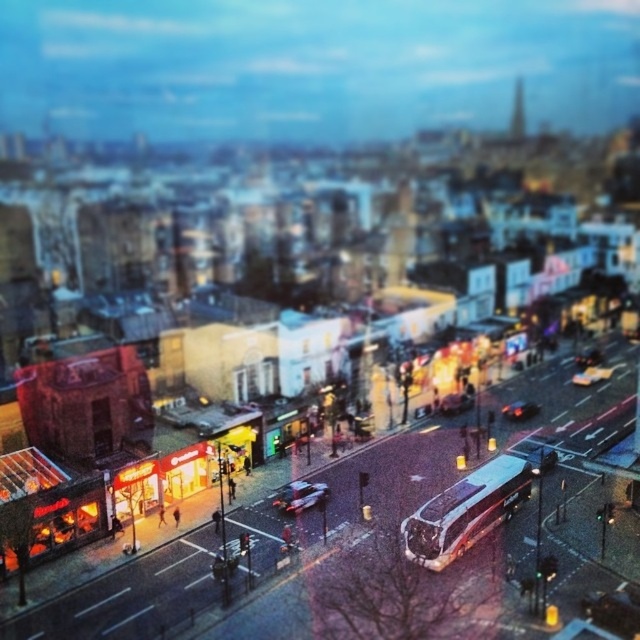
You are a pedestrian standing at the crosswalk and want to cross the street. You see a metallic silver car at center and a shiny black car at center. Which car is closer to the left side of the crosswalk?

The metallic silver car at center is to the left of the shiny black car at center, so it is closer to the left side of the crosswalk.

You are a pedestrian standing at the intersection and see the metallic silver car at center and the shiny black car at center. Which car is closer to you?

The metallic silver car at center is closer to you because it is in front of the shiny black car at center.

You are a drone operator trying to capture the best aerial shot of the city. You have two points marked on your screen, point A at coordinates point (316,483) and point B at coordinates point (513,403). Which point is closer to your drone camera to ensure a clearer focus?

Point point (316,483) is closer to the camera than point point (513,403), so focusing on point point (316,483) will ensure a clearer image.